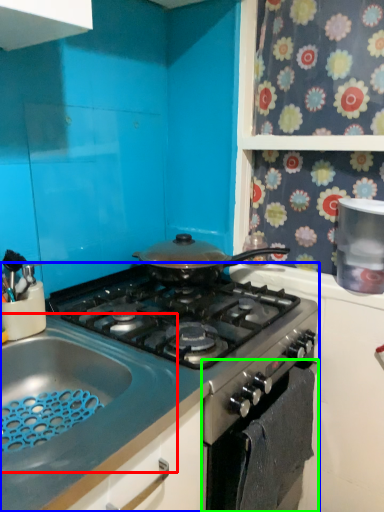
Question: Estimate the real-world distances between objects in this image. Which object is farther from sink (highlighted by a red box), gas stove (highlighted by a blue box) or oven (highlighted by a green box)?

Choices:
 (A) gas stove
 (B) oven

Answer: (B)